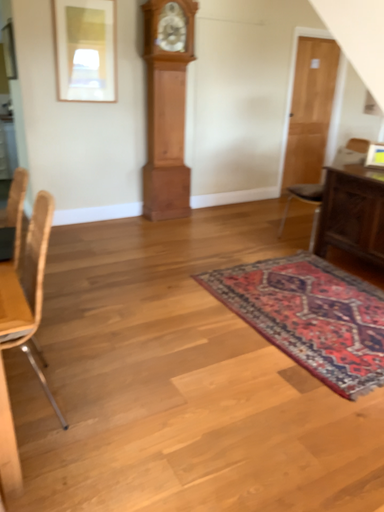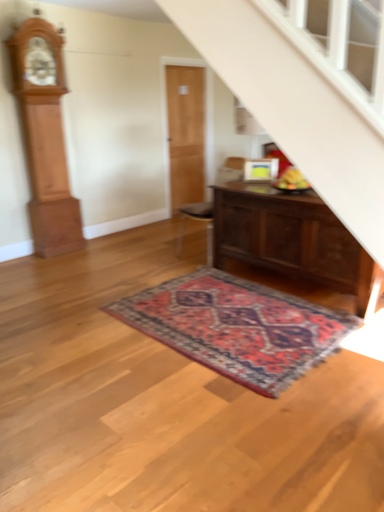
Question: How did the camera likely rotate when shooting the video?

Choices:
 (A) rotated left
 (B) rotated right

Answer: (B)